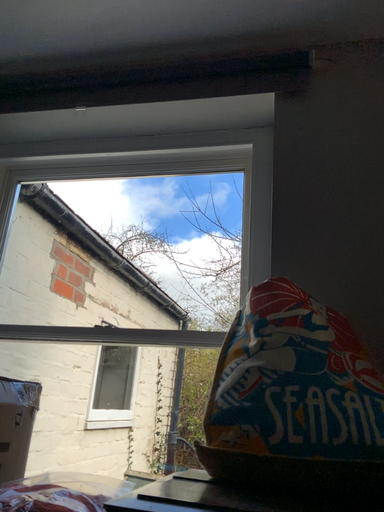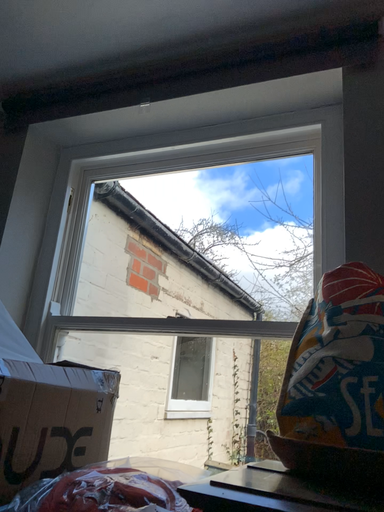
Question: Which way did the camera rotate in the video?

Choices:
 (A) rotated right
 (B) rotated left

Answer: (B)